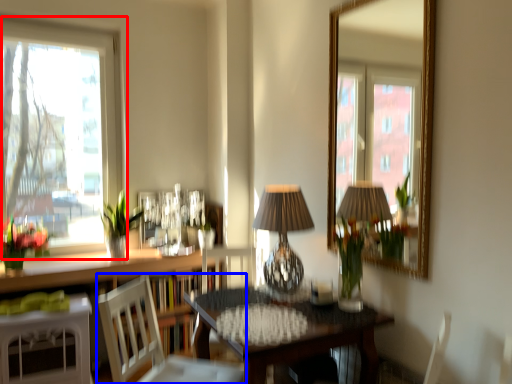
Question: Which of the following is the closest to the observer, window (highlighted by a red box) or chair (highlighted by a blue box)?

Choices:
 (A) window
 (B) chair

Answer: (B)